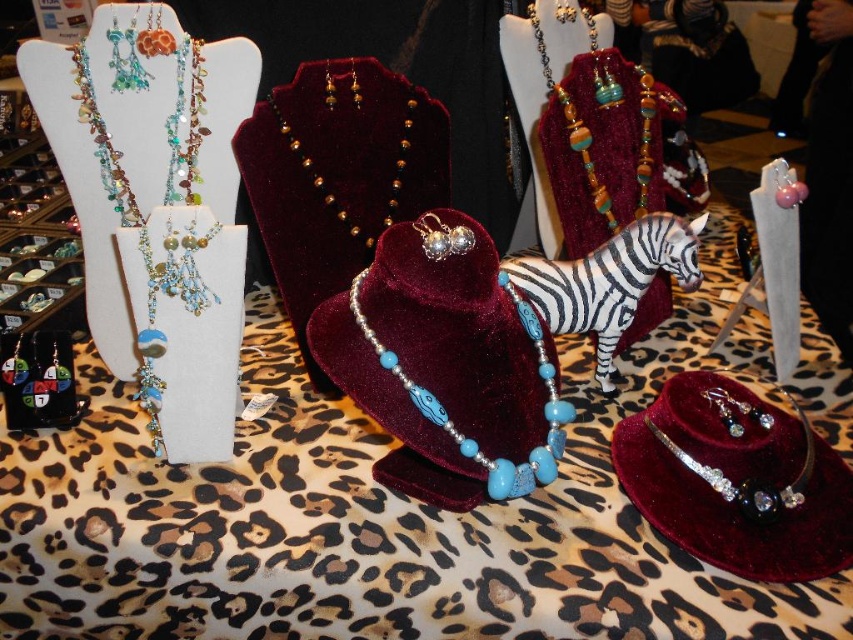
Question: Which point is farther to the camera?

Choices:
 (A) (393, 355)
 (B) (677, 444)
 (C) (566, 99)

Answer: (C)

Question: Which object appears farthest from the camera in this image?

Choices:
 (A) matte blue beaded necklace at left
 (B) swarovski crystal bracelet at center

Answer: (A)

Question: Is matte blue beaded necklace at left smaller than swarovski crystal bracelet at center?

Choices:
 (A) yes
 (B) no

Answer: (B)

Question: Is matte blue beaded necklace at left closer to camera compared to turquoise beaded necklace at center?

Choices:
 (A) no
 (B) yes

Answer: (B)

Question: Which point is closer to the camera?

Choices:
 (A) gold beaded necklace at center
 (B) swarovski crystal bracelet at center

Answer: (B)

Question: Does matte blue beaded necklace at left lie behind swarovski crystal bracelet at center?

Choices:
 (A) no
 (B) yes

Answer: (B)